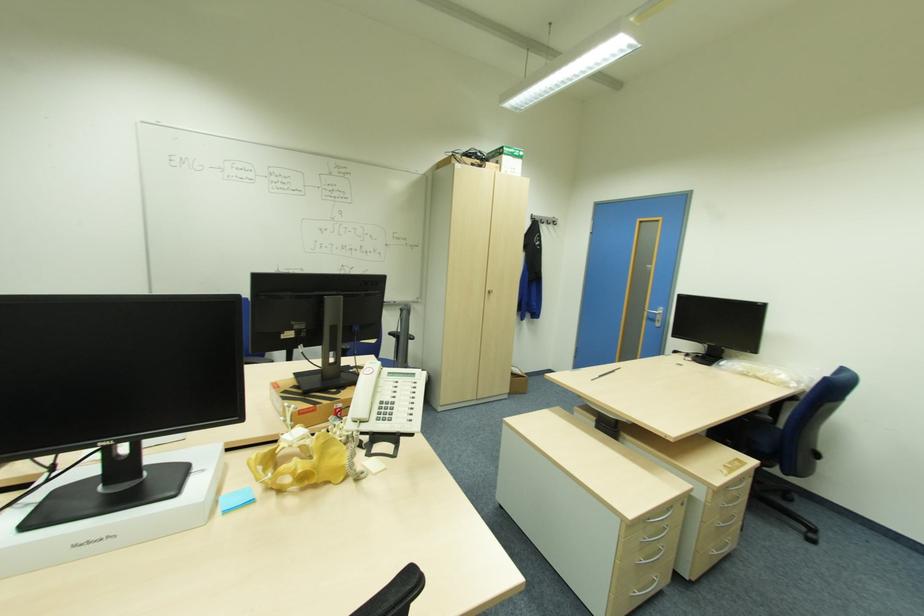
Where would you lift the white telephone handset? Please return your answer as a coordinate pair (x, y).

(363, 392)